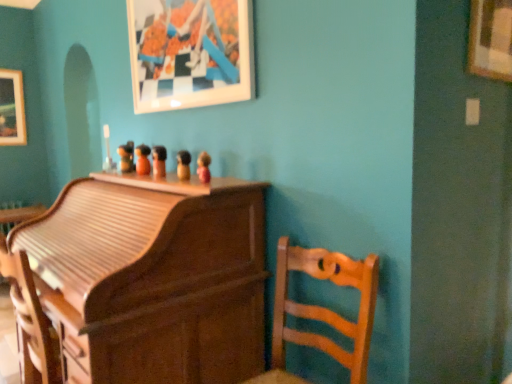
Find the location of `free space behind matte wooden figurine at center, which is the 5th toy from left to right`. free space behind matte wooden figurine at center, which is the 5th toy from left to right is located at coordinates coord(198,182).